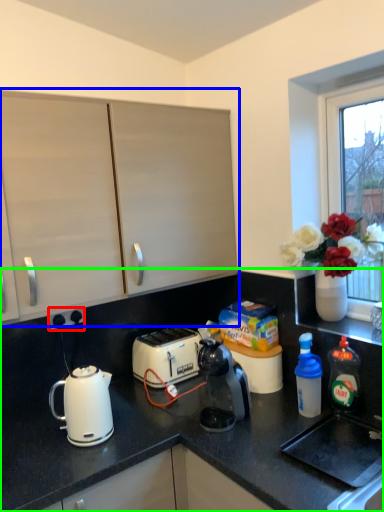
Question: Which object is positioned farthest from electric outlet (highlighted by a red box)? Select from cabinetry (highlighted by a blue box) and countertop (highlighted by a green box).

Choices:
 (A) cabinetry
 (B) countertop

Answer: (A)